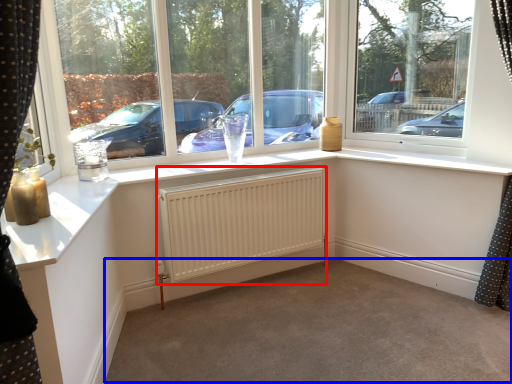
Question: Which point is closer to the camera, radiator (highlighted by a red box) or plain (highlighted by a blue box)?

Choices:
 (A) radiator
 (B) plain

Answer: (B)